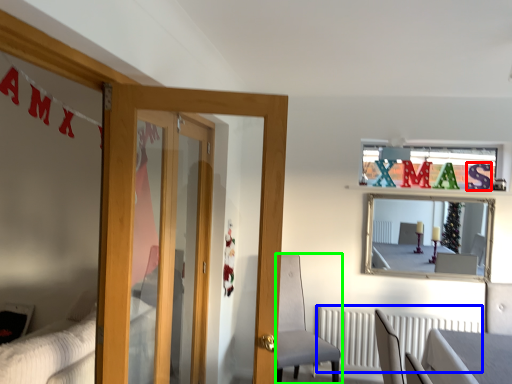
Question: Which is farther away from letter (highlighted by a red box)? radiator (highlighted by a blue box) or chair (highlighted by a green box)?

Choices:
 (A) radiator
 (B) chair

Answer: (B)